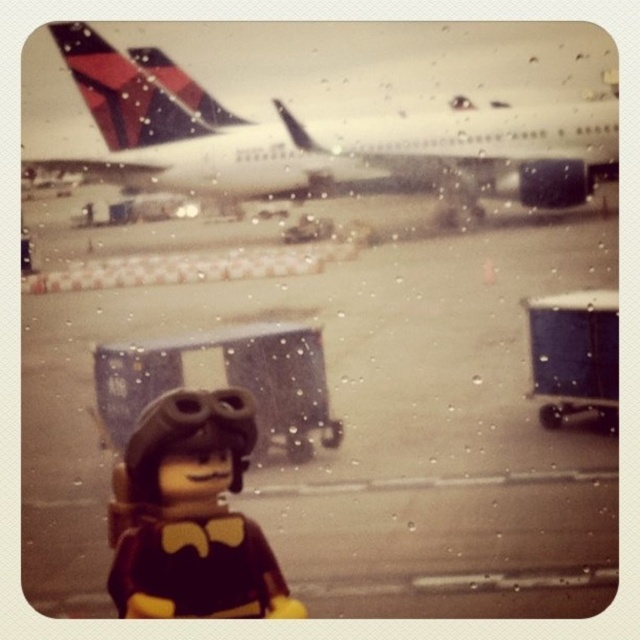
Question: Does smooth concrete tarmac at center have a larger size compared to white matte airplane at upper center?

Choices:
 (A) yes
 (B) no

Answer: (A)

Question: Which object appears farthest from the camera in this image?

Choices:
 (A) smooth concrete tarmac at center
 (B) white matte airplane at upper center

Answer: (B)

Question: Can you confirm if smooth concrete tarmac at center is positioned to the left of white matte airplane at upper center?

Choices:
 (A) no
 (B) yes

Answer: (A)

Question: Which point is farther to the camera?

Choices:
 (A) (337, 120)
 (B) (529, 605)

Answer: (A)

Question: Is smooth concrete tarmac at center to the right of white matte airplane at upper center from the viewer's perspective?

Choices:
 (A) yes
 (B) no

Answer: (A)